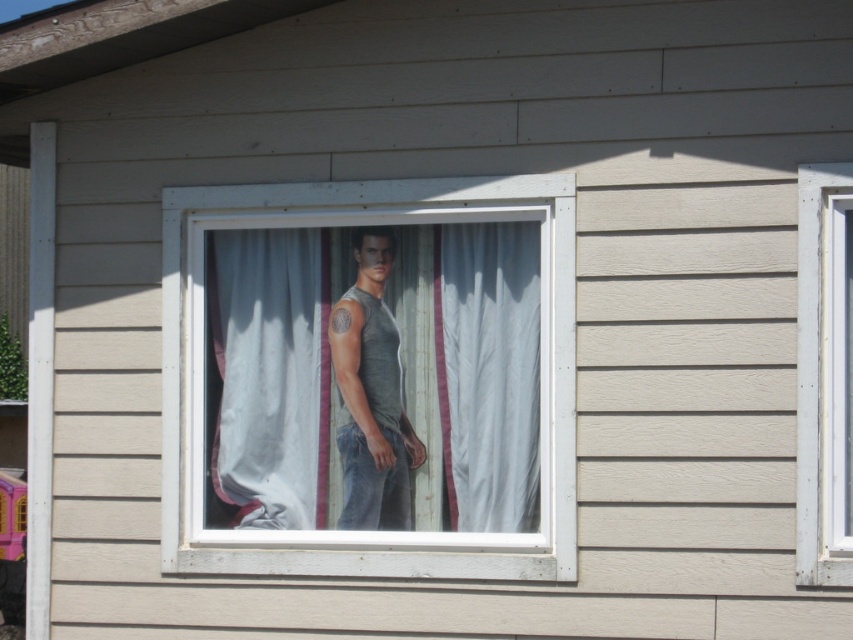
This screenshot has height=640, width=853. What do you see at coordinates (357, 224) in the screenshot?
I see `matte gray tank top at center` at bounding box center [357, 224].

How distant is matte gray tank top at center from white sheer fabric at center?

matte gray tank top at center is 9.31 inches from white sheer fabric at center.

Between point (287, 572) and point (251, 513), which one is positioned in front?

Point (287, 572) is more forward.

Where is `matte gray tank top at center`? matte gray tank top at center is located at coordinates 357,224.

Which is in front, point (282, 508) or point (805, 385)?

Point (805, 385) is in front.

Image resolution: width=853 pixels, height=640 pixels. What do you see at coordinates (267, 376) in the screenshot? I see `white sheer fabric at center` at bounding box center [267, 376].

Locate an element on the screen. The image size is (853, 640). white sheer fabric at center is located at coordinates (267, 376).

Does matte gray tank top at center have a greater width compared to white wood frame at right?

Yes.

Which is in front, point (177, 496) or point (842, 470)?

Point (842, 470) is more forward.

Where is `matte gray tank top at center`? This screenshot has height=640, width=853. matte gray tank top at center is located at coordinates tap(357, 224).